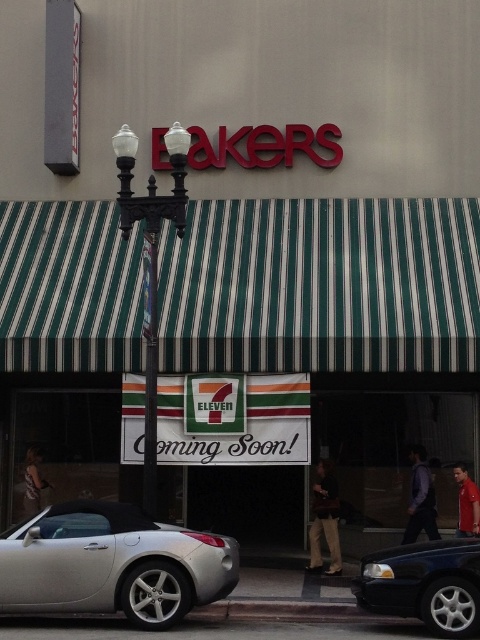
Question: Does silver metallic convertible at lower left have a smaller size compared to metallic streetlamp at center?

Choices:
 (A) no
 (B) yes

Answer: (A)

Question: Is polished brass streetlamp at center-left in front of metallic streetlamp at center?

Choices:
 (A) no
 (B) yes

Answer: (B)

Question: Is silver metallic convertible at lower left below polished brass streetlamp at center-left?

Choices:
 (A) no
 (B) yes

Answer: (B)

Question: Which point is closer to the camera?

Choices:
 (A) polished brass streetlamp at center-left
 (B) shiny black sedan at lower right
 (C) silver metallic convertible at lower left
 (D) metallic streetlamp at center

Answer: (B)

Question: Based on their relative distances, which object is nearer to the silver metallic convertible at lower left?

Choices:
 (A) shiny black sedan at lower right
 (B) metallic streetlamp at center

Answer: (B)

Question: Based on their relative distances, which object is farther from the metallic streetlamp at center?

Choices:
 (A) silver metallic convertible at lower left
 (B) polished brass streetlamp at center-left

Answer: (A)